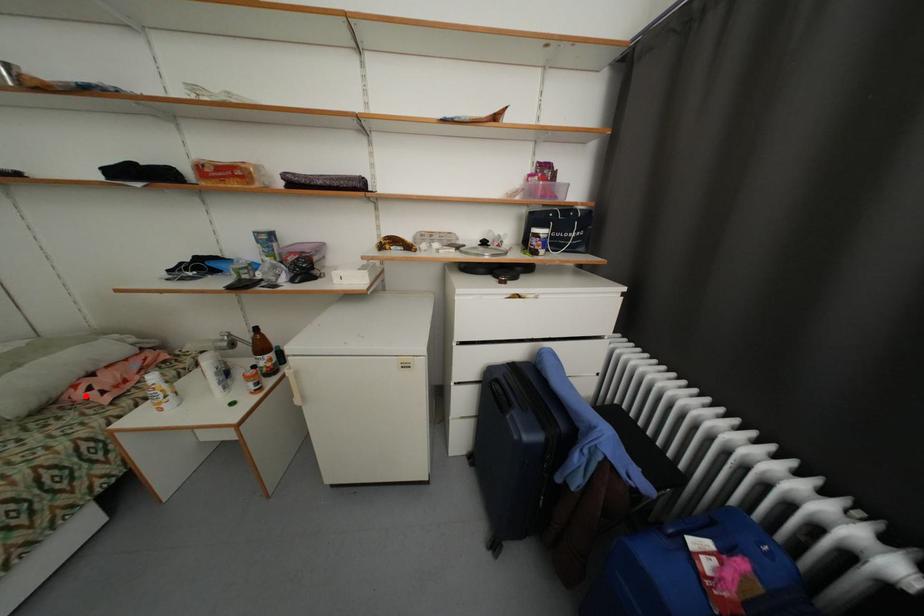
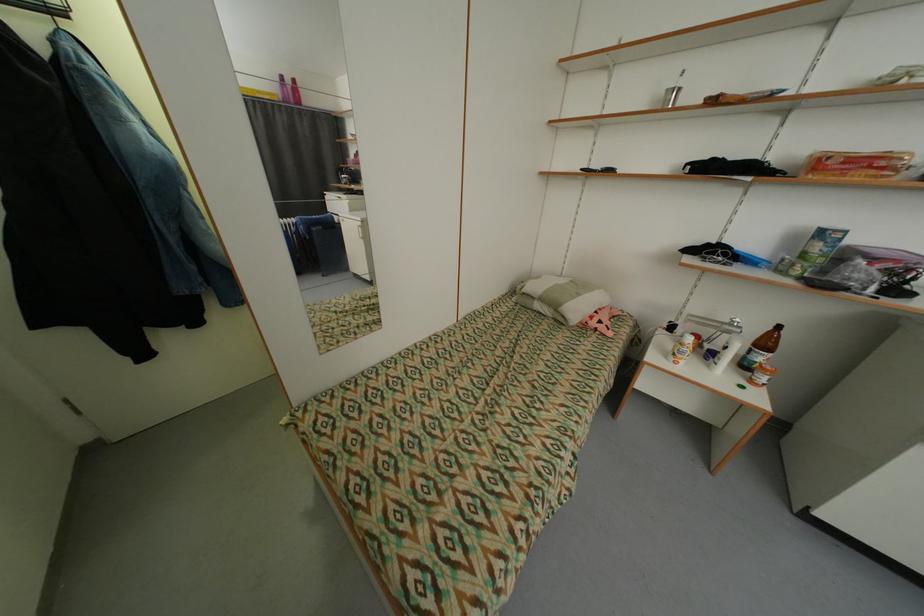
Question: I am providing you with two images of the same scene from different viewpoints. In image1, a red point is highlighted. Considering the same 3D point in image2, which of the following is correct?

Choices:
 (A) It is closer
 (B) It is farther

Answer: (B)